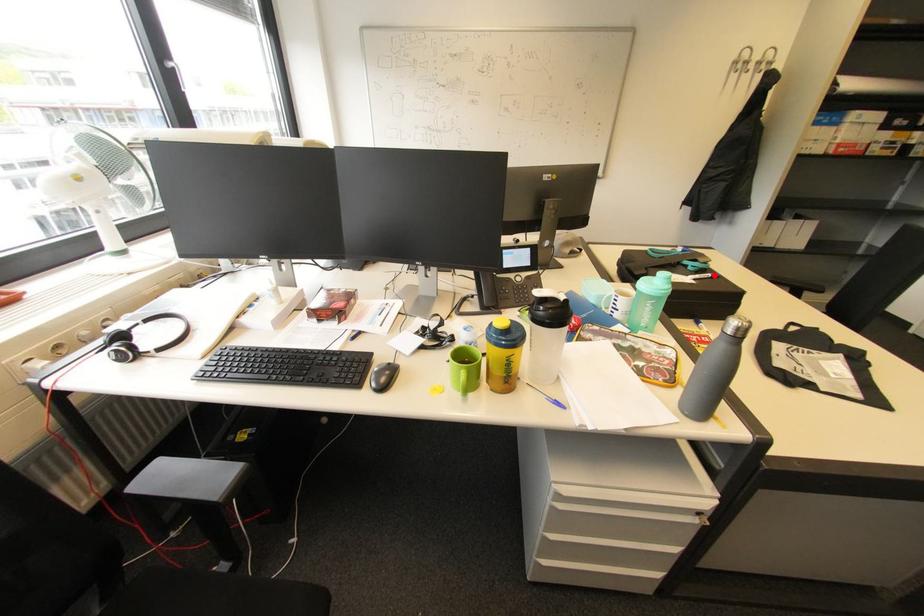
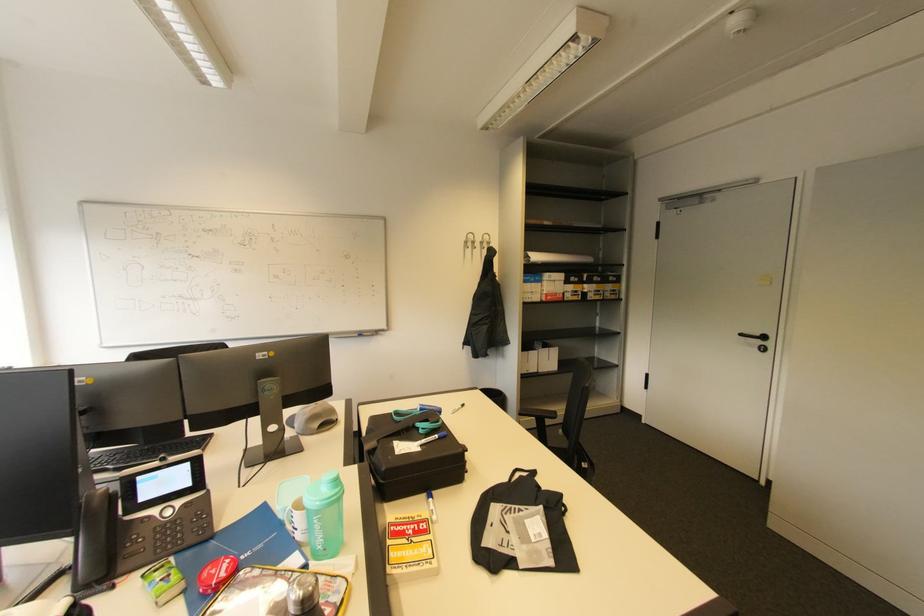
Find the pixel in the second image that matches the highlighted location in the first image.

(441, 437)